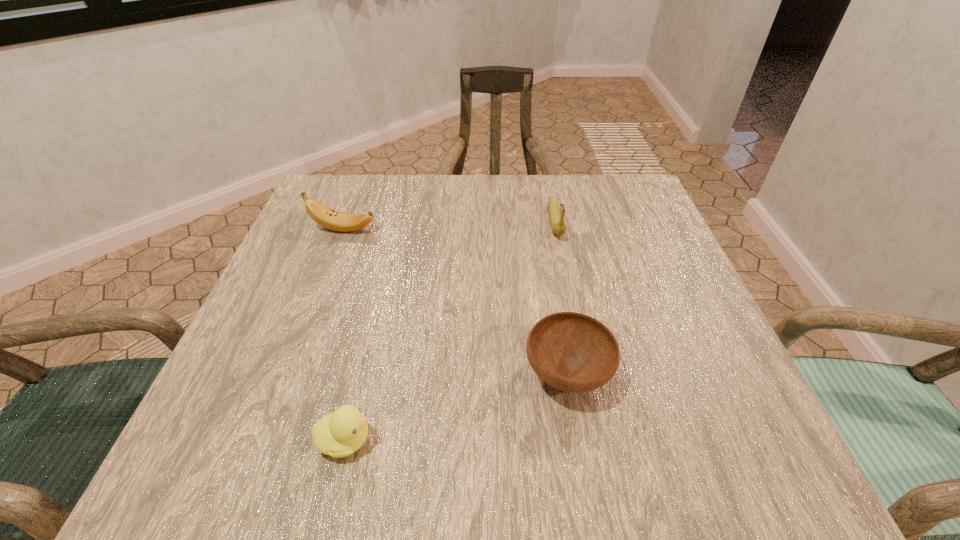
Image resolution: width=960 pixels, height=540 pixels. I want to click on object at the far left corner, so click(328, 217).

The image size is (960, 540). In the image, there is a desktop. What are the coordinates of `free region at the far edge` in the screenshot? It's located at (540, 195).

Locate an element on the screen. vacant space at the near edge of the desktop is located at coordinates (577, 435).

Locate an element on the screen. blank area at the left edge is located at coordinates (329, 305).

Image resolution: width=960 pixels, height=540 pixels. Find the location of `vacant space at the right edge of the desktop`. vacant space at the right edge of the desktop is located at coordinates coord(630,309).

Where is `vacant space at the far right corner of the desktop`? This screenshot has height=540, width=960. vacant space at the far right corner of the desktop is located at coordinates (648, 226).

In the image, there is a desktop. At what (x,y) coordinates should I click in order to perform the action: click on blank space at the near right corner. Please return your answer as a coordinate pair (x, y). This screenshot has width=960, height=540. Looking at the image, I should click on (679, 451).

Where is `free space between the left banana and the second nearest object`? The image size is (960, 540). free space between the left banana and the second nearest object is located at coordinates (455, 301).

Image resolution: width=960 pixels, height=540 pixels. What are the coordinates of `free space between the left banana and the duckling` in the screenshot? It's located at (345, 334).

I want to click on free space between the left banana and the nearest object, so (x=345, y=334).